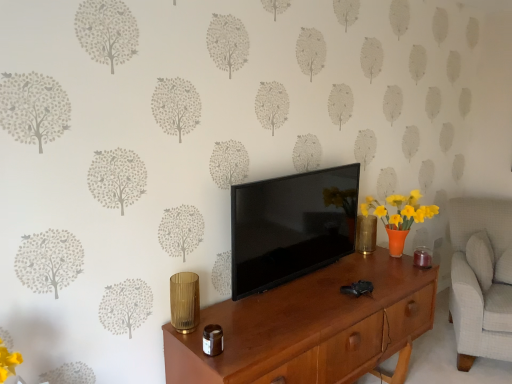
Question: Would you say gold textured vase at center-right is to the left or to the right of wooden desk at center in the picture?

Choices:
 (A) left
 (B) right

Answer: (B)

Question: Considering the positions of point (358, 218) and point (292, 360), is point (358, 218) closer or farther from the camera than point (292, 360)?

Choices:
 (A) closer
 (B) farther

Answer: (B)

Question: Based on their relative distances, which object is nearer to the gold textured vase at center-right?

Choices:
 (A) wooden desk at center
 (B) black glossy tv at center
 (C) light gray fabric swivel chair at right

Answer: (B)

Question: Estimate the real-world distances between objects in this image. Which object is farther from the light gray fabric swivel chair at right?

Choices:
 (A) gold textured vase at center-right
 (B) black glossy tv at center
 (C) wooden desk at center

Answer: (B)